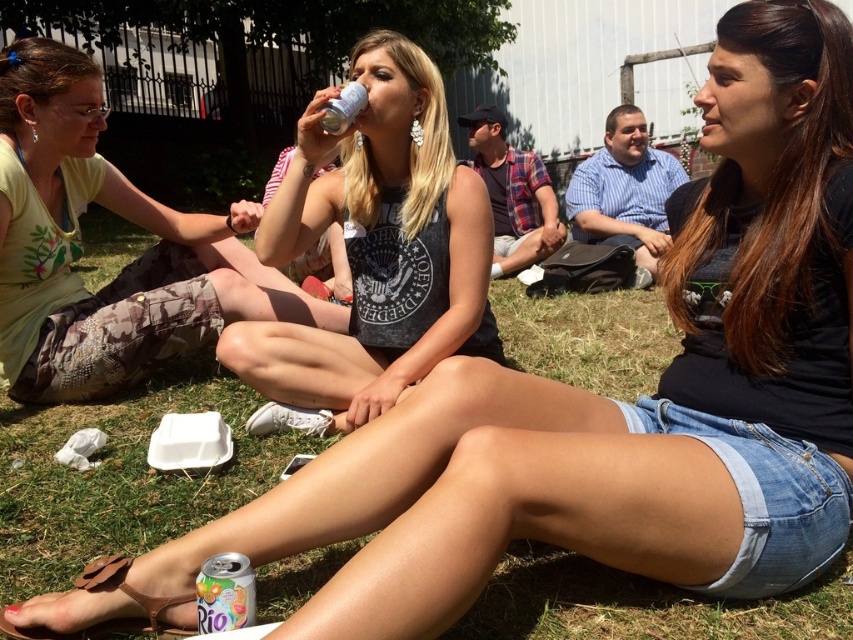
Question: Is the position of camouflage pants at left more distant than that of clear plastic can at center?

Choices:
 (A) yes
 (B) no

Answer: (A)

Question: Which object appears farthest from the camera in this image?

Choices:
 (A) clear plastic can at center
 (B) camouflage pants at left
 (C) brown leather sandal at lower left
 (D) metallic silver can at lower left

Answer: (B)

Question: Which point is closer to the camera?

Choices:
 (A) camouflage pants at left
 (B) matte black tank top at center

Answer: (B)

Question: Is camouflage pants at left above metallic silver can at lower left?

Choices:
 (A) no
 (B) yes

Answer: (B)

Question: Which of the following is the farthest from the observer?

Choices:
 (A) (351, 120)
 (B) (222, 557)

Answer: (A)

Question: Does camouflage pants at left have a larger size compared to clear plastic can at center?

Choices:
 (A) yes
 (B) no

Answer: (A)